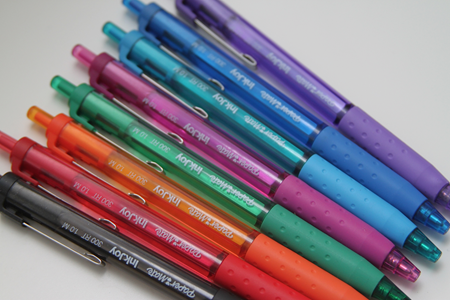
Identify the location of pens. The height and width of the screenshot is (300, 450). (77, 228), (92, 197), (122, 169), (148, 135), (172, 109), (198, 87), (221, 72), (247, 45).